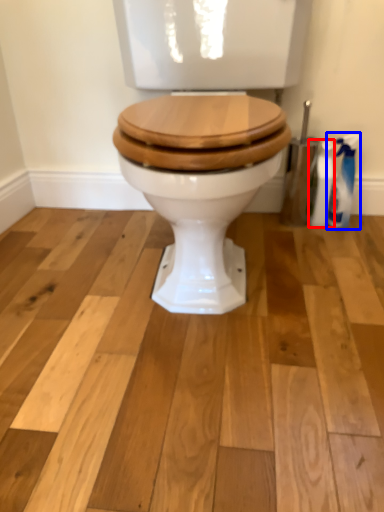
Question: Which of the following is the farthest to the observer, cleaning product (highlighted by a red box) or cleaning product (highlighted by a blue box)?

Choices:
 (A) cleaning product
 (B) cleaning product

Answer: (A)